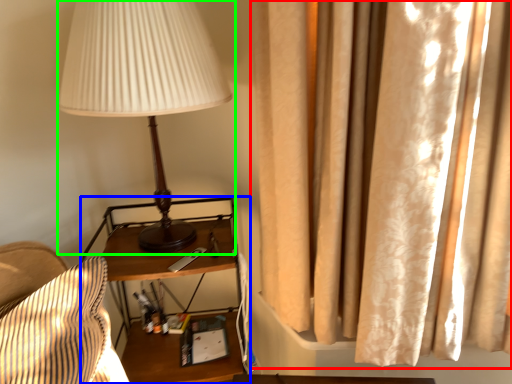
Question: Which is nearer to the curtain (highlighted by a red box)? nightstand (highlighted by a blue box) or lamp (highlighted by a green box).

Choices:
 (A) nightstand
 (B) lamp

Answer: (B)